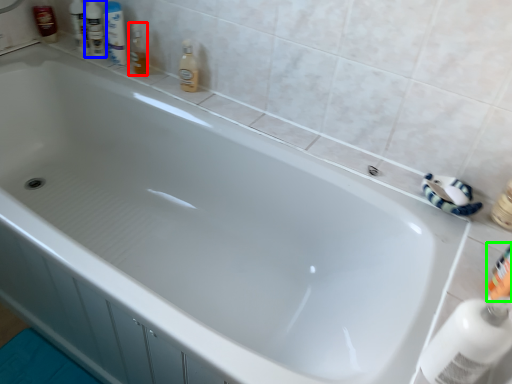
Question: Which is farther away from toiletry (highlighted by a red box)? toiletry (highlighted by a blue box) or toiletry (highlighted by a green box)?

Choices:
 (A) toiletry
 (B) toiletry

Answer: (B)